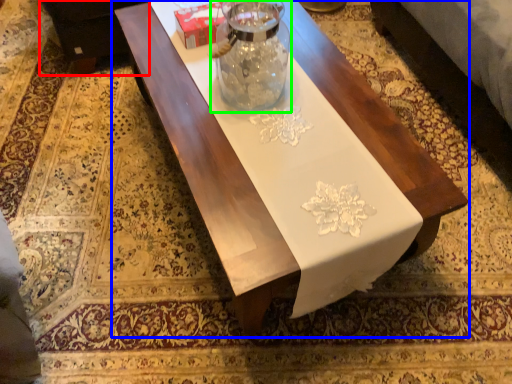
Question: Estimate the real-world distances between objects in this image. Which object is farther from couch (highlighted by a red box), table (highlighted by a blue box) or glass vase (highlighted by a green box)?

Choices:
 (A) table
 (B) glass vase

Answer: (B)